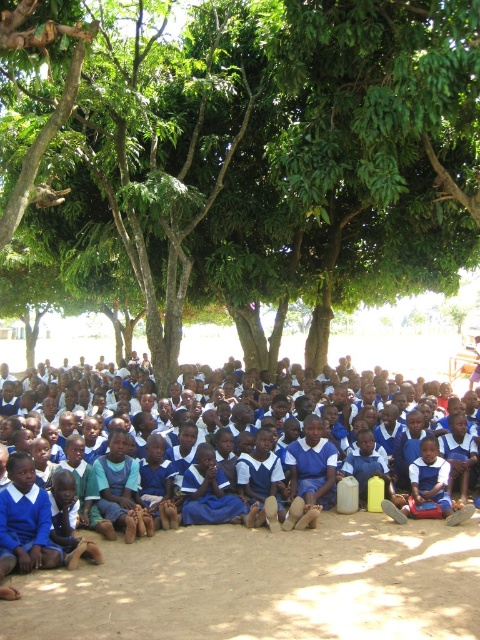
Question: Does green leafy tree at center appear on the left side of blue fabric uniform at center?

Choices:
 (A) yes
 (B) no

Answer: (B)

Question: Is green leafy tree at center above blue fabric uniform at center?

Choices:
 (A) no
 (B) yes

Answer: (B)

Question: Among these objects, which one is farthest from the camera?

Choices:
 (A) green leafy tree at center
 (B) blue fabric uniform at center

Answer: (A)

Question: Is the position of green leafy tree at center less distant than that of blue fabric uniform at center?

Choices:
 (A) no
 (B) yes

Answer: (A)